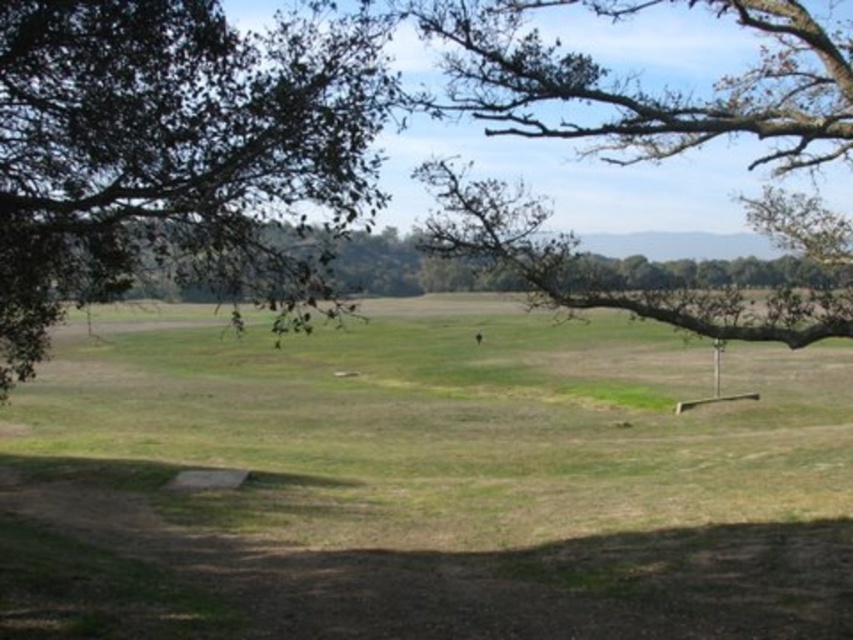
You are an artist setting up an easel to paint the landscape. You want to capture the green leafy tree at upper left and the brown textured branch at upper right in your painting. Which object should you place on the left side of your canvas to maintain the scene as seen?

You should place the green leafy tree at upper left on the left side of your canvas because it is positioned on the left side of the brown textured branch at upper right in the original scene.

You are an artist sketching the landscape and want to ensure the tree and branch are positioned correctly. According to the scene, is the green leafy tree at upper left placed above or below the brown textured branch at upper right?

The green leafy tree at upper left is below the brown textured branch at upper right.